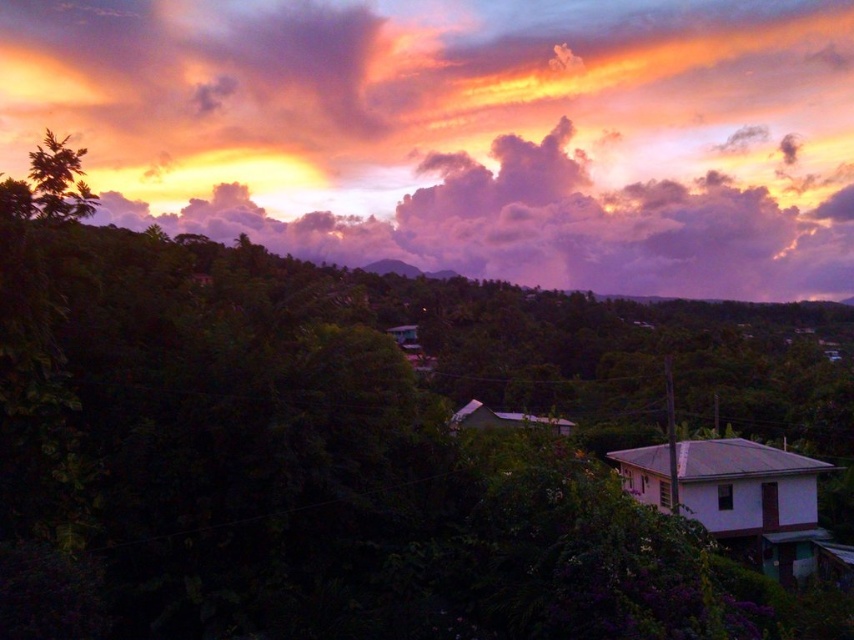
Question: Which of the following is the farthest from the observer?

Choices:
 (A) green leafy tree at upper left
 (B) purple cotton candy cloud at upper center

Answer: (B)

Question: Can you confirm if purple cotton candy cloud at upper center is positioned below green leafy tree at upper left?

Choices:
 (A) no
 (B) yes

Answer: (A)

Question: Can you confirm if purple cotton candy cloud at upper center is bigger than green leafy tree at upper left?

Choices:
 (A) yes
 (B) no

Answer: (B)

Question: Which point is farther to the camera?

Choices:
 (A) (219, 19)
 (B) (88, 193)

Answer: (A)

Question: Is purple cotton candy cloud at upper center above green leafy tree at upper left?

Choices:
 (A) no
 (B) yes

Answer: (B)